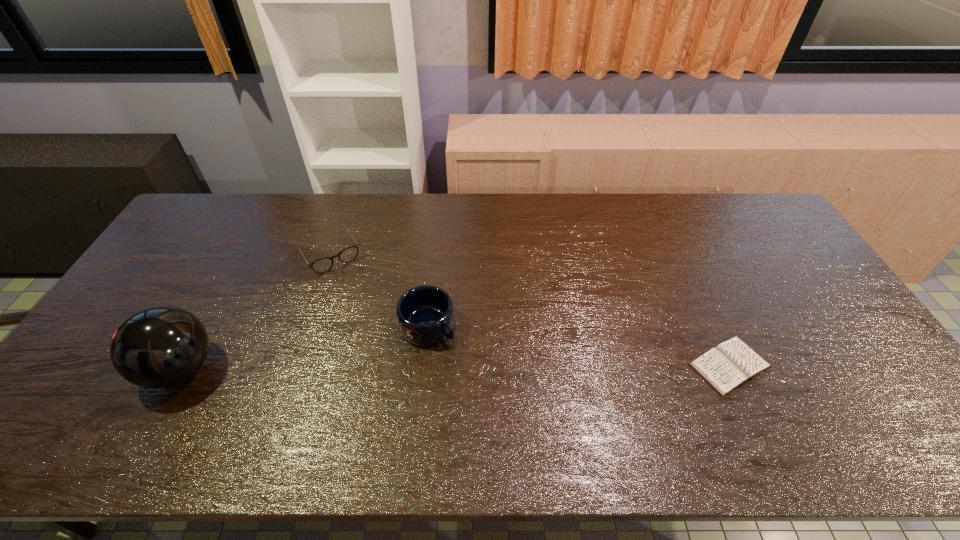
You are a GUI agent. You are given a task and a screenshot of the screen. Output one action in this format:
    pyautogui.click(x=<x>, y=<y>)
    Task: Click on the tallest object
    This screenshot has height=540, width=960.
    Given the screenshot: What is the action you would take?
    pyautogui.click(x=158, y=347)

At what (x,y) coordinates should I click in order to perform the action: click on the leftmost object. Please return your answer as a coordinate pair (x, y). Looking at the image, I should click on (158, 347).

Locate an element on the screen. The width and height of the screenshot is (960, 540). the shortest object is located at coordinates (725, 367).

Locate an element on the screen. The image size is (960, 540). the rightmost object is located at coordinates (725, 367).

What are the coordinates of `the farthest object` in the screenshot? It's located at (322, 265).

At what (x,y) coordinates should I click in order to perform the action: click on the second shortest object. Please return your answer as a coordinate pair (x, y). The width and height of the screenshot is (960, 540). Looking at the image, I should click on (322, 265).

At what (x,y) coordinates should I click in order to perform the action: click on mug. Please return your answer as a coordinate pair (x, y). The width and height of the screenshot is (960, 540). Looking at the image, I should click on (425, 315).

Find the location of a particular element. the second object from right to left is located at coordinates (425, 315).

At what (x,y) coordinates should I click in order to perform the action: click on vacant space situated on the surface of the leftmost object near the finger holes. Please return your answer as a coordinate pair (x, y). This screenshot has height=540, width=960. Looking at the image, I should click on (x=85, y=369).

At what (x,y) coordinates should I click in order to perform the action: click on free region located 0.070m on the surface of the leftmost object near the finger holes. Please return your answer as a coordinate pair (x, y). This screenshot has width=960, height=540. Looking at the image, I should click on (116, 369).